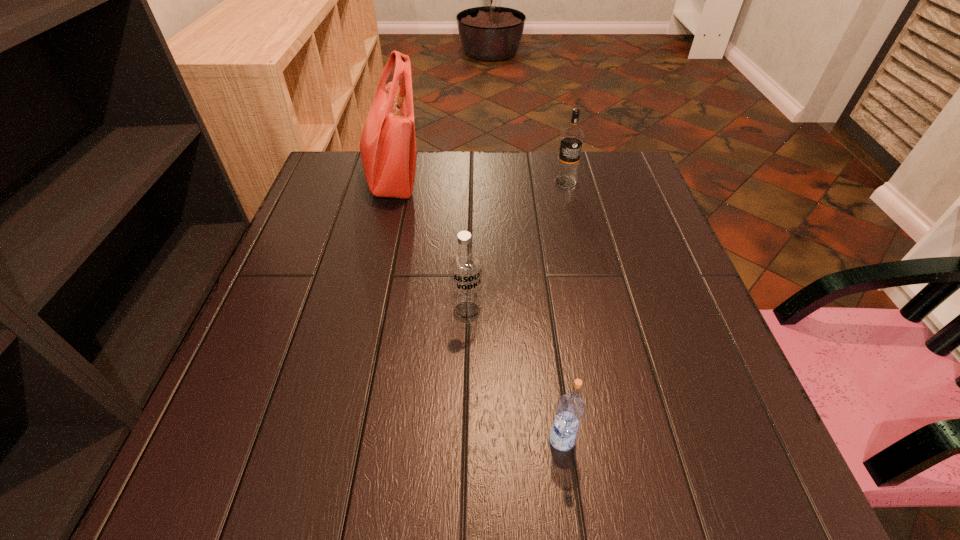
At what (x,y) coordinates should I click in order to perform the action: click on free space located 0.060m on the front label of the second farthest vodka. Please return your answer as a coordinate pair (x, y). Looking at the image, I should click on (466, 350).

You are a GUI agent. You are given a task and a screenshot of the screen. Output one action in this format:
    pyautogui.click(x=<x>, y=<y>)
    Task: Click on the blank area located 0.260m on the right of the nearest vodka
    
    Given the screenshot: What is the action you would take?
    pyautogui.click(x=739, y=439)

The height and width of the screenshot is (540, 960). What are the coordinates of `handbag that is positioned at the far edge` in the screenshot? It's located at (388, 145).

I want to click on vodka that is at the far edge, so click(x=571, y=141).

Locate an element on the screen. The width and height of the screenshot is (960, 540). object located in the near edge section of the desktop is located at coordinates (570, 410).

Find the location of `object positioned at the left edge`. object positioned at the left edge is located at coordinates (388, 145).

Find the location of a particular element. The width and height of the screenshot is (960, 540). object that is at the far left corner is located at coordinates (388, 145).

Where is `vacant space at the far edge of the desktop`? The image size is (960, 540). vacant space at the far edge of the desktop is located at coordinates (487, 168).

You are a GUI agent. You are given a task and a screenshot of the screen. Output one action in this format:
    pyautogui.click(x=<x>, y=<y>)
    Task: Click on the blank area at the near edge
    This screenshot has height=540, width=960.
    Given the screenshot: What is the action you would take?
    pyautogui.click(x=668, y=500)

Identify the location of vacant space at the left edge of the desktop. (263, 332).